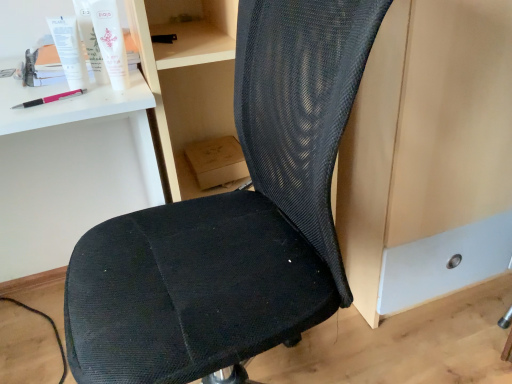
The image size is (512, 384). What do you see at coordinates (49, 99) in the screenshot?
I see `pink plastic pen at upper left` at bounding box center [49, 99].

At what (x,y) coordinates should I click in order to perform the action: click on white matte desk at upper left. Please return your answer as a coordinate pair (x, y). This screenshot has height=384, width=512. Looking at the image, I should click on (72, 172).

Identify the location of white matte tube at upper left, the second toiletry when ordered from right to left. The height and width of the screenshot is (384, 512). (90, 40).

Identify the location of white matte tube at upper left, which ranks as the 1th toiletry in right-to-left order. This screenshot has height=384, width=512. (110, 42).

Measure the distance between black mesh chair at center and white matte tube at upper left, the second toiletry when ordered from right to left.

42.07 centimeters.

Consider the image. Is black mesh chair at center bigger than white matte tube at upper left, which is counted as the first toiletry, starting from the left?

Correct, black mesh chair at center is larger in size than white matte tube at upper left, which is counted as the first toiletry, starting from the left.

Which point is more distant from viewer, [152,331] or [85,32]?

Positioned behind is point [85,32].

Can we say white matte tube at upper left, the second toiletry when ordered from right to left, lies outside white matte desk at upper left?

white matte tube at upper left, the second toiletry when ordered from right to left, is positioned outside white matte desk at upper left.

Considering the sizes of white matte tube at upper left, which is counted as the first toiletry, starting from the left, and white matte desk at upper left in the image, is white matte tube at upper left, which is counted as the first toiletry, starting from the left, wider or thinner than white matte desk at upper left?

white matte tube at upper left, which is counted as the first toiletry, starting from the left, is thinner than white matte desk at upper left.

There is a white matte desk at upper left. Where is `the 1st toiletry above it (from a real-world perspective)`? The width and height of the screenshot is (512, 384). the 1st toiletry above it (from a real-world perspective) is located at coordinates (90, 40).

From the image's perspective, which one is positioned lower, white matte tube at upper left, which is counted as the first toiletry, starting from the left, or white matte desk at upper left?

white matte desk at upper left, from the image's perspective.

Is black mesh chair at center next to white matte tube at upper left, the second toiletry viewed from the left, and touching it?

black mesh chair at center and white matte tube at upper left, the second toiletry viewed from the left, are clearly separated.

Does black mesh chair at center turn towards white matte tube at upper left, the second toiletry viewed from the left?

No, black mesh chair at center is not aimed at white matte tube at upper left, the second toiletry viewed from the left.

Is black mesh chair at center to the left or to the right of white matte tube at upper left, which ranks as the 1th toiletry in right-to-left order, in the image?

black mesh chair at center is to the right of white matte tube at upper left, which ranks as the 1th toiletry in right-to-left order.

Is black mesh chair at center positioned before white matte tube at upper left, the second toiletry viewed from the left?

Yes.

How distant is black mesh chair at center from white plastic tube at upper left?

black mesh chair at center is 16.87 inches from white plastic tube at upper left.

Does black mesh chair at center have a lesser width compared to white plastic tube at upper left?

No.

Is black mesh chair at center far away from white plastic tube at upper left?

No, black mesh chair at center is not far from white plastic tube at upper left.

In the scene shown: Measure the distance between white matte tube at upper left, the second toiletry viewed from the left, and white matte tube at upper left, which is counted as the first toiletry, starting from the left.

white matte tube at upper left, the second toiletry viewed from the left, is 4.04 centimeters away from white matte tube at upper left, which is counted as the first toiletry, starting from the left.

The height and width of the screenshot is (384, 512). I want to click on toiletry on the left side of white matte tube at upper left, the second toiletry viewed from the left, so click(x=90, y=40).

Considering the relative positions of white matte tube at upper left, which ranks as the 1th toiletry in right-to-left order, and white matte tube at upper left, which is counted as the first toiletry, starting from the left, in the image provided, is white matte tube at upper left, which ranks as the 1th toiletry in right-to-left order, to the right of white matte tube at upper left, which is counted as the first toiletry, starting from the left, from the viewer's perspective?

Indeed, white matte tube at upper left, which ranks as the 1th toiletry in right-to-left order, is positioned on the right side of white matte tube at upper left, which is counted as the first toiletry, starting from the left.

Is white matte tube at upper left, the second toiletry viewed from the left, positioned before white matte tube at upper left, which is counted as the first toiletry, starting from the left?

Yes, it is in front of white matte tube at upper left, which is counted as the first toiletry, starting from the left.

In the scene shown: Does white matte tube at upper left, the second toiletry when ordered from right to left, have a greater height compared to white matte tube at upper left, which ranks as the 1th toiletry in right-to-left order?

In fact, white matte tube at upper left, the second toiletry when ordered from right to left, may be shorter than white matte tube at upper left, which ranks as the 1th toiletry in right-to-left order.

How different are the orientations of white matte tube at upper left, which is counted as the first toiletry, starting from the left, and white matte tube at upper left, which ranks as the 1th toiletry in right-to-left order, in degrees?

6 degrees separate the facing orientations of white matte tube at upper left, which is counted as the first toiletry, starting from the left, and white matte tube at upper left, which ranks as the 1th toiletry in right-to-left order.

Is point (84, 6) farther from viewer compared to point (119, 72)?

No, (84, 6) is in front of (119, 72).

Does pink plastic pen at upper left come in front of white matte desk at upper left?

No, pink plastic pen at upper left is behind white matte desk at upper left.

From a real-world perspective, which object stands above the other?

In real-world perspective, pink plastic pen at upper left is above.

Are pink plastic pen at upper left and white matte desk at upper left located far from each other?

No, pink plastic pen at upper left is in close proximity to white matte desk at upper left.

How distant is pink plastic pen at upper left from white matte desk at upper left?

pink plastic pen at upper left and white matte desk at upper left are 44.04 centimeters apart from each other.

Where is `toiletry that is the 2nd one when counting backward from the black mesh chair at center`? toiletry that is the 2nd one when counting backward from the black mesh chair at center is located at coordinates (90, 40).

Locate an element on the screen. Image resolution: width=512 pixels, height=384 pixels. computer desk located underneath the white matte tube at upper left, the second toiletry when ordered from right to left (from a real-world perspective) is located at coordinates (72, 172).

Considering their positions, is white matte tube at upper left, the second toiletry when ordered from right to left, positioned further to black mesh chair at center than white plastic tube at upper left?

white plastic tube at upper left is positioned further to the anchor black mesh chair at center.

Based on their spatial positions, is black mesh chair at center or white plastic tube at upper left further from white matte tube at upper left, which ranks as the 1th toiletry in right-to-left order?

→ black mesh chair at center is further to white matte tube at upper left, which ranks as the 1th toiletry in right-to-left order.

From the image, which object appears to be nearer to white matte tube at upper left, which ranks as the 1th toiletry in right-to-left order, white plastic tube at upper left or black mesh chair at center?

white plastic tube at upper left.

Which object lies further to the anchor point white matte tube at upper left, which is counted as the first toiletry, starting from the left, black mesh chair at center or pink plastic pen at upper left?

Based on the image, black mesh chair at center appears to be further to white matte tube at upper left, which is counted as the first toiletry, starting from the left.

Based on their spatial positions, is white matte tube at upper left, which is counted as the first toiletry, starting from the left, or white plastic tube at upper left closer to white matte desk at upper left?

The object closer to white matte desk at upper left is white plastic tube at upper left.

Considering their positions, is black mesh chair at center positioned closer to white plastic tube at upper left than white matte tube at upper left, which ranks as the 1th toiletry in right-to-left order?

white matte tube at upper left, which ranks as the 1th toiletry in right-to-left order, is closer to white plastic tube at upper left.

When comparing their distances from white plastic tube at upper left, does white matte tube at upper left, which ranks as the 1th toiletry in right-to-left order, or pink plastic pen at upper left seem closer?

Among the two, pink plastic pen at upper left is located nearer to white plastic tube at upper left.

When comparing their distances from black mesh chair at center, does white matte tube at upper left, the second toiletry viewed from the left, or pink plastic pen at upper left seem further?

The object further to black mesh chair at center is pink plastic pen at upper left.

Locate an element on the screen. This screenshot has width=512, height=384. toiletry between white matte tube at upper left, which is counted as the first toiletry, starting from the left, and pink plastic pen at upper left, in the vertical direction is located at coordinates pyautogui.click(x=110, y=42).

The height and width of the screenshot is (384, 512). I want to click on equipment between white matte tube at upper left, the second toiletry when ordered from right to left, and white matte desk at upper left in the up-down direction, so click(x=49, y=99).

Find the location of `toiletry between white plastic tube at upper left and white matte tube at upper left, the second toiletry viewed from the left`. toiletry between white plastic tube at upper left and white matte tube at upper left, the second toiletry viewed from the left is located at coordinates (90, 40).

The height and width of the screenshot is (384, 512). In order to click on toothpaste between white matte tube at upper left, the second toiletry viewed from the left, and white matte desk at upper left vertically in this screenshot , I will do `click(69, 50)`.